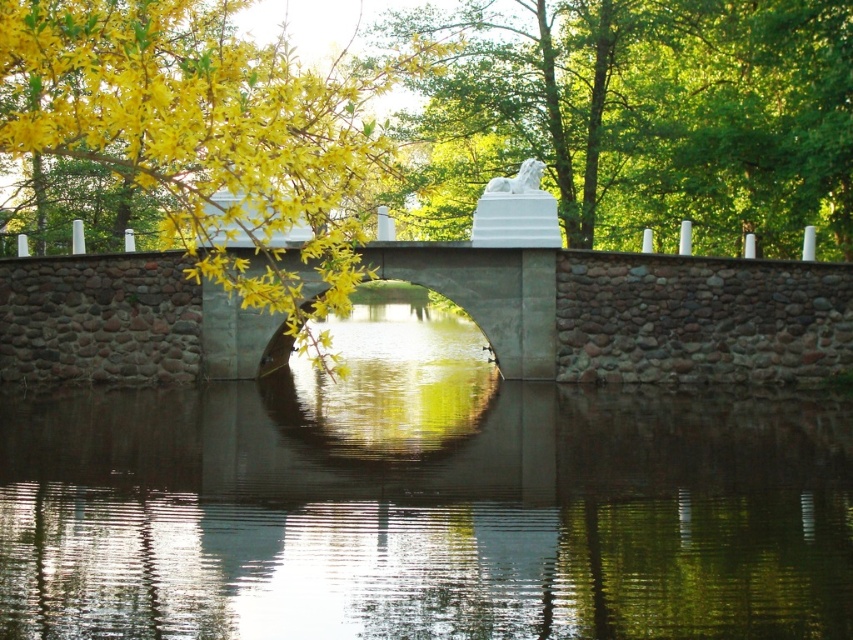
Is white stone lion at upper center shorter than yellow leafy branches at upper left?

Indeed, white stone lion at upper center has a lesser height compared to yellow leafy branches at upper left.

Which is behind, point (840, 108) or point (148, 156)?

The point (840, 108) is behind.

This screenshot has height=640, width=853. Find the location of `white stone lion at upper center`. white stone lion at upper center is located at coordinates (647, 116).